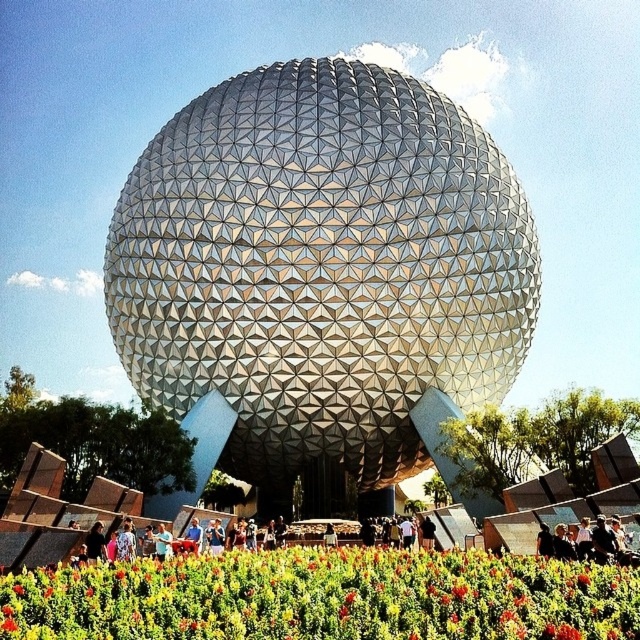
Which is behind, point (156, 298) or point (637, 634)?

Point (156, 298)

Measure the distance between white textured sphere at center and camera.

white textured sphere at center is 64.83 meters away from camera.

Is point (260, 113) farther from viewer compared to point (58, 628)?

Yes, it is behind point (58, 628).

Where is `white textured sphere at center`? The width and height of the screenshot is (640, 640). white textured sphere at center is located at coordinates (321, 275).

Between metallic sphere at center and vibrant floral carpet at center, which one appears on the left side from the viewer's perspective?

metallic sphere at center is more to the left.

Which is below, metallic sphere at center or vibrant floral carpet at center?

vibrant floral carpet at center is lower down.

Who is more distant from viewer, (172,580) or (362,576)?

Point (362,576)

At what (x,y) coordinates should I click in order to perform the action: click on metallic sphere at center. Please return your answer as a coordinate pair (x, y). The image size is (640, 640). Looking at the image, I should click on (324, 596).

Who is more forward, [324,422] or [349,577]?

Point [349,577] is more forward.

Who is positioned more to the right, white textured sphere at center or vibrant floral carpet at center?

From the viewer's perspective, vibrant floral carpet at center appears more on the right side.

Does point (412, 352) come behind point (396, 579)?

Yes, it is behind point (396, 579).

Identify the location of white textured sphere at center. The width and height of the screenshot is (640, 640). (321, 275).